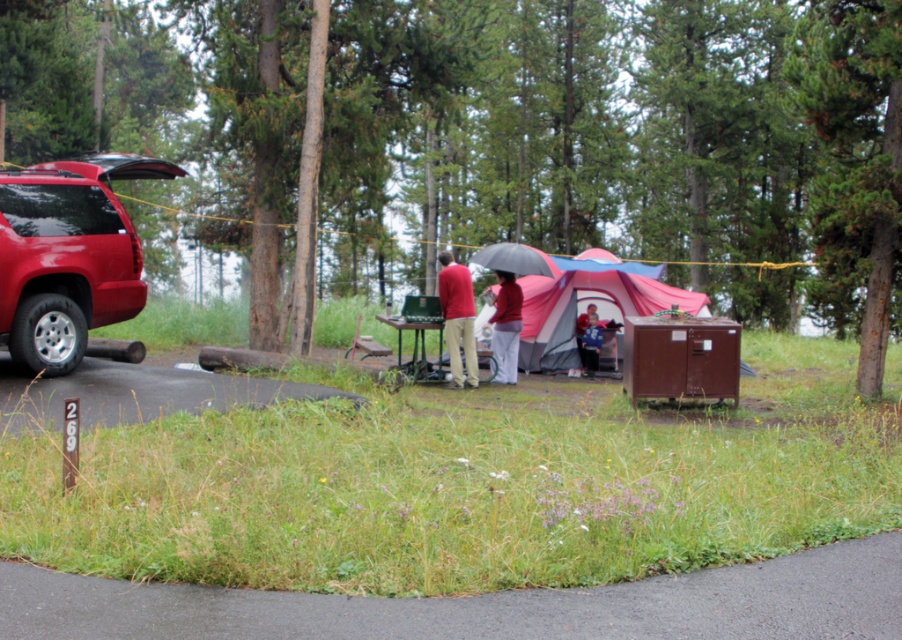
Is point (507, 326) positioned before point (489, 246)?

Yes, it is in front of point (489, 246).

Which of these two, matte red umbrella at center or black matte umbrella at center, stands taller?

matte red umbrella at center

Is point (513, 291) farther from viewer compared to point (504, 252)?

That is True.

Image resolution: width=902 pixels, height=640 pixels. Find the location of `matte red umbrella at center`. matte red umbrella at center is located at coordinates (505, 326).

Is pink fabric tent at center thinner than black matte umbrella at center?

No.

This screenshot has width=902, height=640. Identify the location of pink fabric tent at center. (587, 305).

Where is `pink fabric tent at center`? pink fabric tent at center is located at coordinates (587, 305).

Does matte red shirt at center appear on the right side of matte red umbrella at center?

No, matte red shirt at center is not to the right of matte red umbrella at center.

Can you confirm if matte red shirt at center is taller than matte red umbrella at center?

No.

Does point (440, 296) come closer to viewer compared to point (511, 369)?

Yes, point (440, 296) is in front of point (511, 369).

In order to click on matte red shirt at center in this screenshot , I will do `click(457, 317)`.